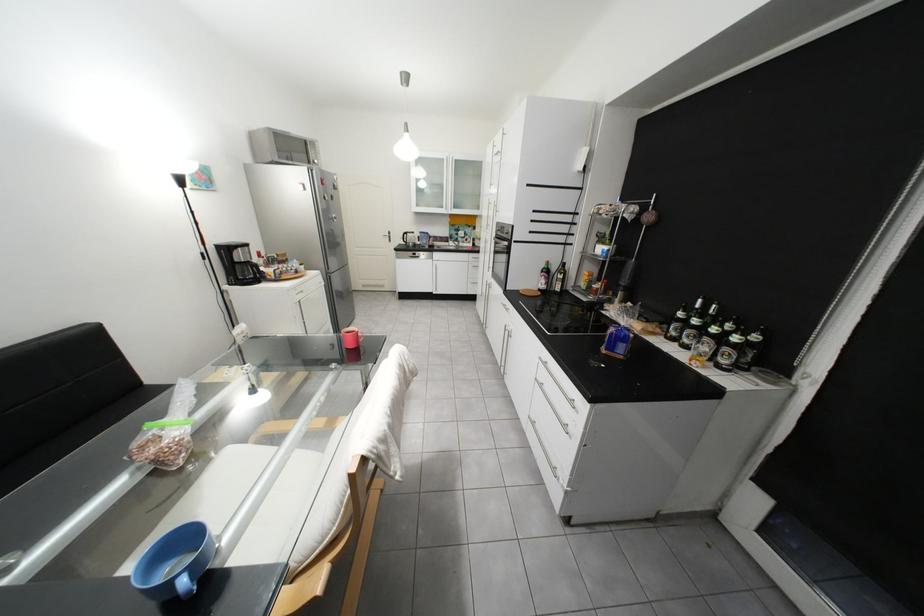
The image size is (924, 616). Describe the element at coordinates (545, 454) in the screenshot. I see `a silver cabinet handle` at that location.